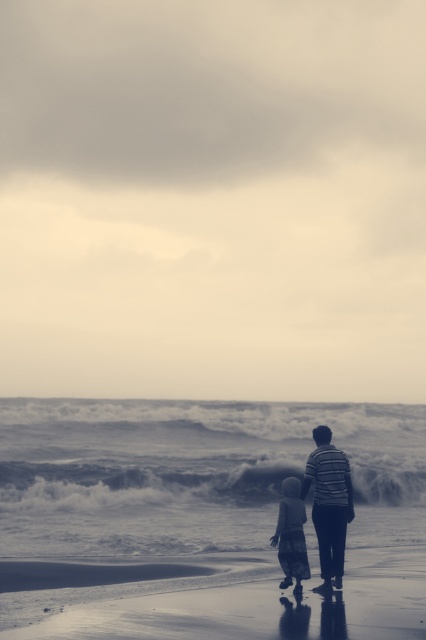
You are a photographer trying to capture the smooth sand at lower center and the striped fabric at center in the same frame. Which object would you need to adjust your camera angle to include more of in the shot?

The striped fabric at center is larger than the smooth sand at lower center, so you would need to adjust your camera angle to include more of the smooth sand at lower center.

You are a photographer trying to capture the striped fabric at center and the light gray cotton dress at lower center in the same frame. Which object should you focus on first to ensure both are in focus?

The striped fabric at center is in front of the light gray cotton dress at lower center, so you should focus on the striped fabric at center first to ensure both are in focus.

You are a photographer planning to capture the coastal scene. You want to ensure the smooth sand at lower center and the striped fabric at center are both visible in the frame. Given their widths, which object should you prioritize framing closer to the edge of the photo to avoid overcrowding?

The striped fabric at center has a narrower width compared to the smooth sand at lower center. To avoid overcrowding, prioritize framing the striped fabric at center closer to the edge of the photo since it requires less space.